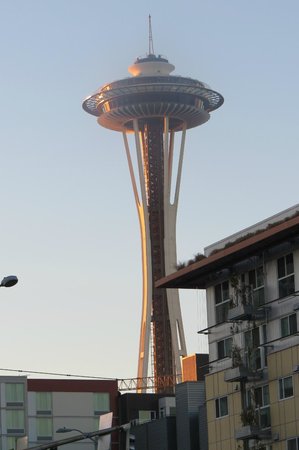
At what (x,y) coordinates should I click in order to perform the action: click on white wall. Please return your answer as a coordinate pair (x, y). This screenshot has height=450, width=299. Looking at the image, I should click on (207, 315), (273, 287), (277, 325).